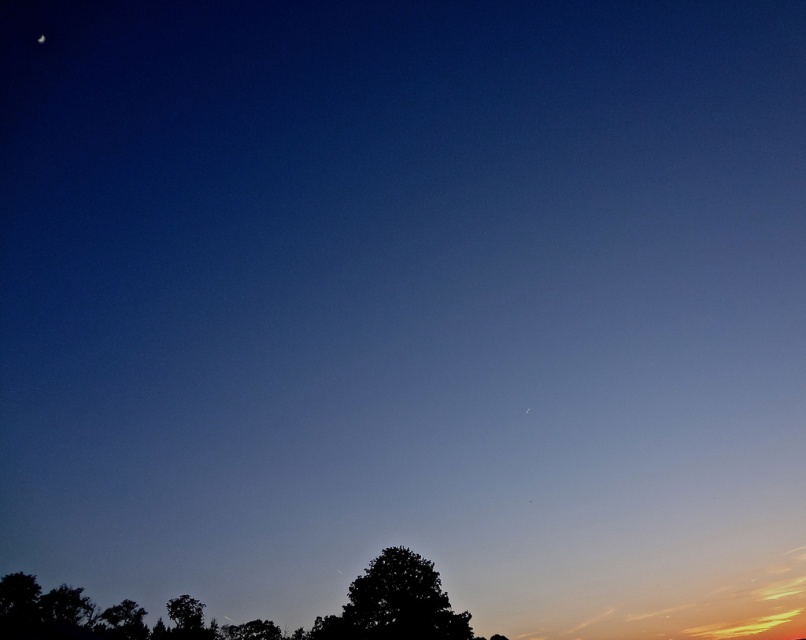
Who is higher up, dark green leafy tree at lower center or white glossy moon at upper left?

white glossy moon at upper left is higher up.

Can you confirm if dark green leafy tree at lower center is thinner than white glossy moon at upper left?

Incorrect, dark green leafy tree at lower center's width is not less than white glossy moon at upper left's.

Is point (410, 570) positioned in front of point (44, 35)?

Yes, point (410, 570) is closer to viewer.

At what (x,y) coordinates should I click in order to perform the action: click on dark green leafy tree at lower center. Please return your answer as a coordinate pair (x, y). Looking at the image, I should click on (393, 604).